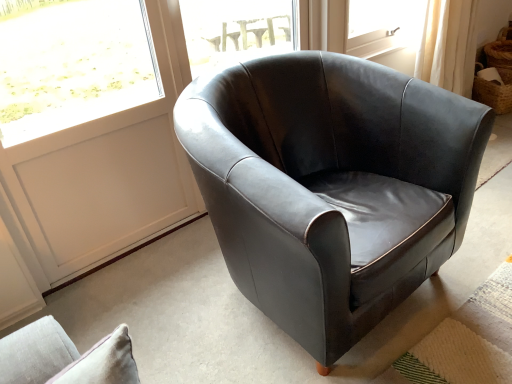
Question: Is white panel at upper left turned away from matte black armchair at center?

Choices:
 (A) yes
 (B) no

Answer: (B)

Question: Is white panel at upper left positioned before matte black armchair at center?

Choices:
 (A) yes
 (B) no

Answer: (B)

Question: Is white panel at upper left shorter than matte black armchair at center?

Choices:
 (A) no
 (B) yes

Answer: (A)

Question: Is white panel at upper left not inside matte black armchair at center?

Choices:
 (A) no
 (B) yes

Answer: (B)

Question: Could you tell me if white panel at upper left is turned towards matte black armchair at center?

Choices:
 (A) yes
 (B) no

Answer: (A)

Question: From their relative heights in the image, would you say transparent glass window at center is taller or shorter than woven brown basket at upper right?

Choices:
 (A) tall
 (B) short

Answer: (A)

Question: In the image, is transparent glass window at center on the left side or the right side of woven brown basket at upper right?

Choices:
 (A) right
 (B) left

Answer: (B)

Question: From the image's perspective, relative to woven brown basket at upper right, is transparent glass window at center above or below?

Choices:
 (A) above
 (B) below

Answer: (B)

Question: Is point (269, 36) positioned closer to the camera than point (472, 89)?

Choices:
 (A) farther
 (B) closer

Answer: (B)

Question: Is matte black armchair at center inside or outside of transparent glass window at center?

Choices:
 (A) inside
 (B) outside

Answer: (B)

Question: Is matte black armchair at center bigger or smaller than transparent glass window at center?

Choices:
 (A) big
 (B) small

Answer: (A)

Question: Is matte black armchair at center taller or shorter than transparent glass window at center?

Choices:
 (A) tall
 (B) short

Answer: (A)

Question: In the image, is matte black armchair at center on the left side or the right side of transparent glass window at center?

Choices:
 (A) right
 (B) left

Answer: (A)

Question: In terms of width, does white panel at upper left look wider or thinner when compared to transparent glass window at center?

Choices:
 (A) thin
 (B) wide

Answer: (A)

Question: From a real-world perspective, is white panel at upper left above or below transparent glass window at center?

Choices:
 (A) above
 (B) below

Answer: (B)